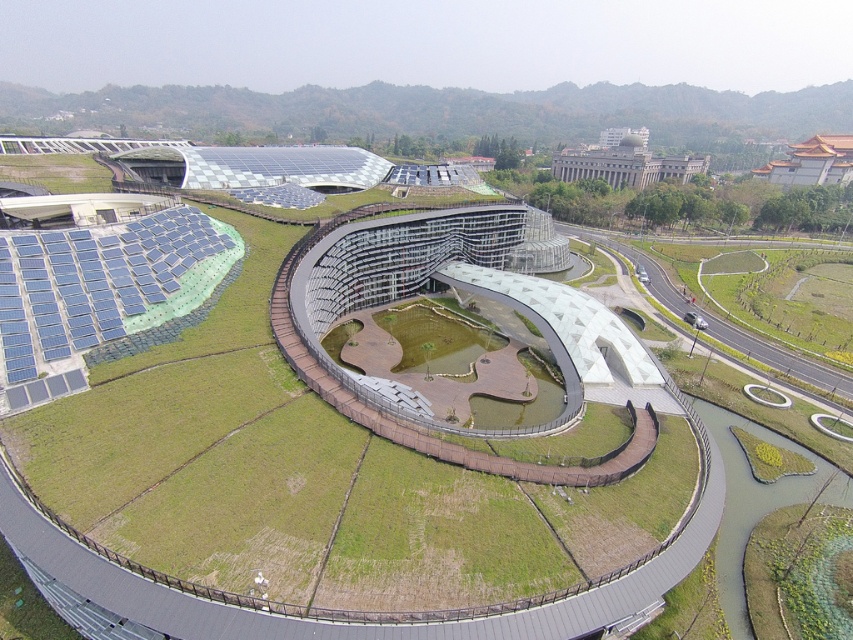
Can you confirm if green grass at center is positioned above yellow/golden tile roof at upper right?

Incorrect, green grass at center is not positioned above yellow/golden tile roof at upper right.

Who is shorter, green grass at center or yellow/golden tile roof at upper right?

yellow/golden tile roof at upper right is shorter.

The height and width of the screenshot is (640, 853). In order to click on green grass at center in this screenshot , I will do `click(329, 621)`.

In the scene shown: Does white stone building at upper right appear under yellow/golden tile roof at upper right?

Correct, white stone building at upper right is located below yellow/golden tile roof at upper right.

Image resolution: width=853 pixels, height=640 pixels. In order to click on white stone building at upper right in this screenshot , I will do `click(625, 164)`.

At what (x,y) coordinates should I click in order to perform the action: click on white stone building at upper right. Please return your answer as a coordinate pair (x, y). Looking at the image, I should click on (625, 164).

Which is above, green grass at center or white stone building at upper right?

white stone building at upper right

Who is more forward, (173, 627) or (589, 156)?

Point (173, 627) is more forward.

Who is more distant from viewer, (206, 616) or (695, 166)?

The point (695, 166) is behind.

Locate an element on the screen. This screenshot has width=853, height=640. green grass at center is located at coordinates (329, 621).